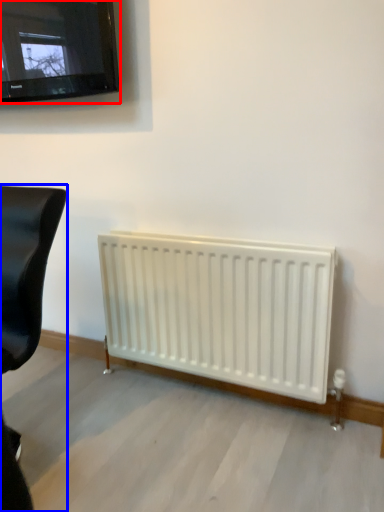
Question: Which point is further to the camera, television (highlighted by a red box) or furniture (highlighted by a blue box)?

Choices:
 (A) television
 (B) furniture

Answer: (A)